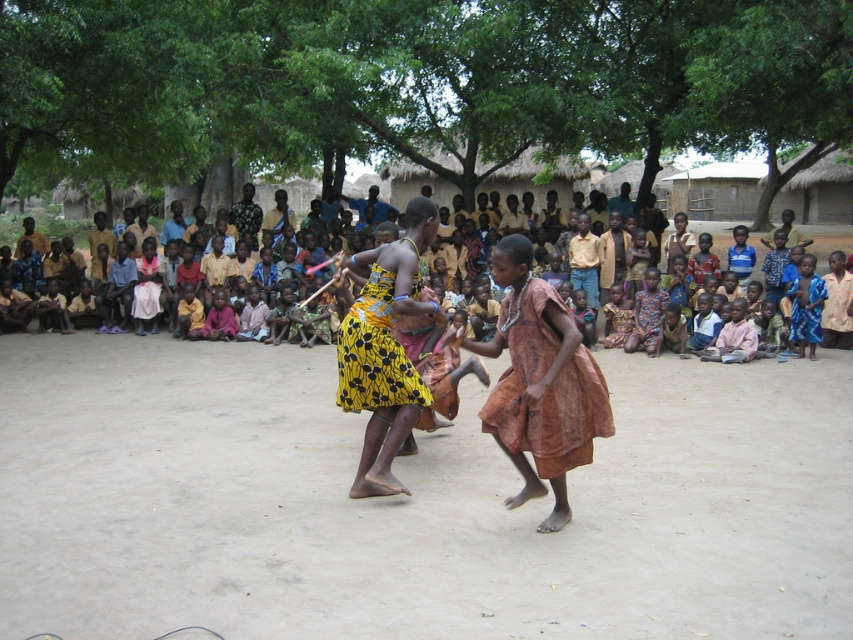
Question: Considering the real-world distances, which object is closest to the yellow printed fabric dress at center?

Choices:
 (A) yellow printed dress at center
 (B) brown fabric dress at center

Answer: (A)

Question: Among these points, which one is nearest to the camera?

Choices:
 (A) (500, 333)
 (B) (350, 308)
 (C) (422, 228)

Answer: (A)

Question: Is the position of brown fabric dress at center more distant than that of yellow printed fabric dress at center?

Choices:
 (A) no
 (B) yes

Answer: (A)

Question: Which point is farther to the camera?

Choices:
 (A) (395, 360)
 (B) (605, 385)
 (C) (346, 392)

Answer: (C)

Question: Is yellow printed dress at center to the left of yellow printed fabric dress at center from the viewer's perspective?

Choices:
 (A) yes
 (B) no

Answer: (A)

Question: Does yellow printed dress at center appear over yellow printed fabric dress at center?

Choices:
 (A) yes
 (B) no

Answer: (B)